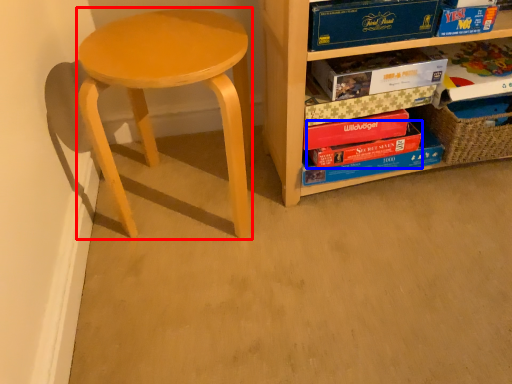
Question: Which object appears closest to the camera in this image, stool (highlighted by a red box) or paperback book (highlighted by a blue box)?

Choices:
 (A) stool
 (B) paperback book

Answer: (A)